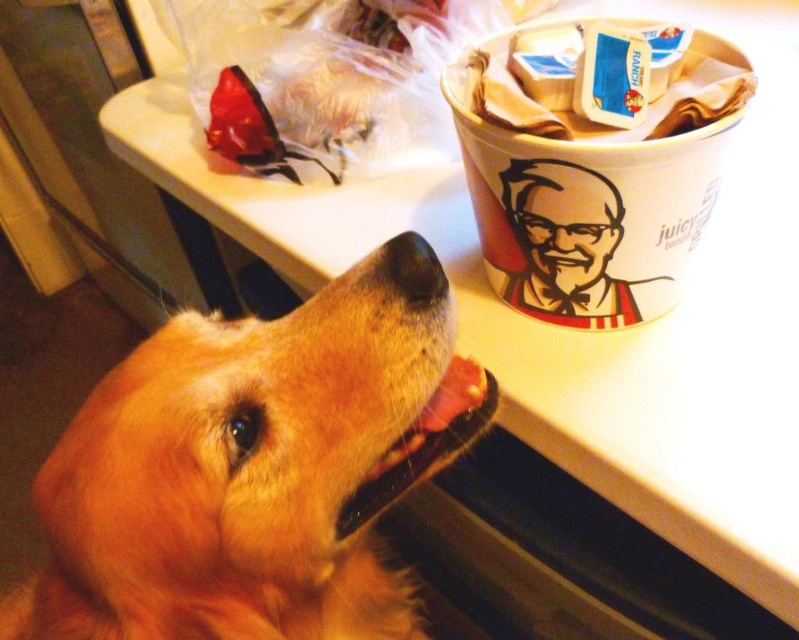
You are a photographer trying to capture a closeup of the golden fur dog at center and the white paper cup at upper right. Since you want both subjects to be in focus, you need to know which one is wider. Which object is wider?

The golden fur dog at center is wider than the white paper cup at upper right.

You are a photographer trying to capture a closeup of the white paper cup at upper right without the golden fur dog at center blocking it. What should you do?

Move the camera position to the right side so that the white paper cup at upper right is visible without the golden fur dog at center blocking it, since the dog is in front of the cup.